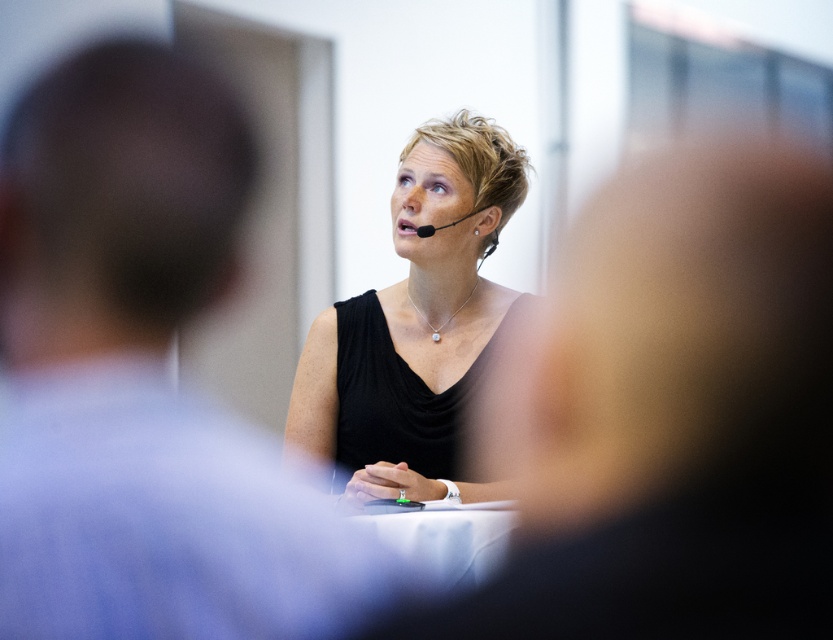
Consider the image. Which of these two, black matte dress at center or matte black face at center, stands taller?

black matte dress at center

In the scene shown: Is black matte dress at center taller than matte black face at center?

Yes, black matte dress at center is taller than matte black face at center.

This screenshot has height=640, width=833. Find the location of `black matte dress at center`. black matte dress at center is located at coordinates (416, 324).

Locate an element on the screen. Image resolution: width=833 pixels, height=640 pixels. black matte dress at center is located at coordinates (416, 324).